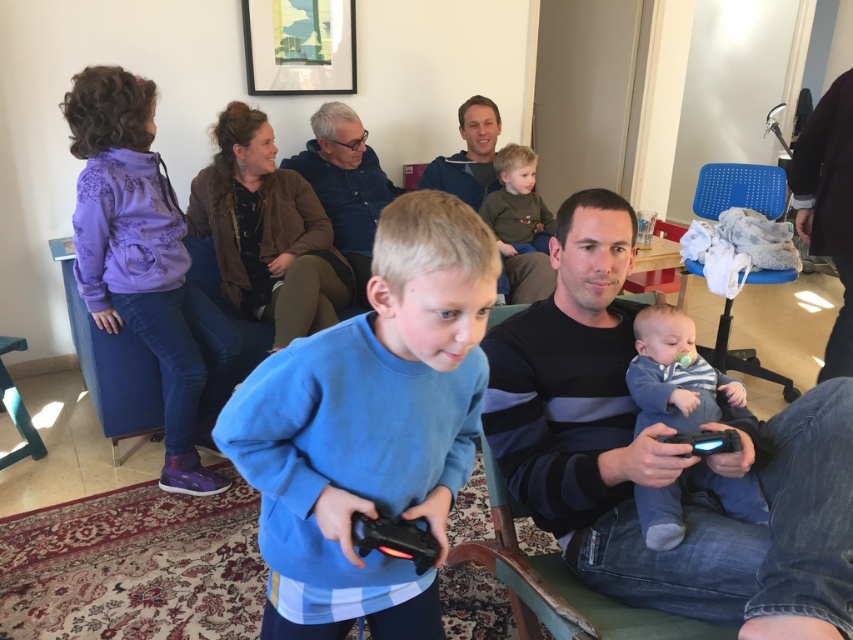
Question: Is blue mesh chair at upper right further to the viewer compared to dark green sweater at center?

Choices:
 (A) no
 (B) yes

Answer: (A)

Question: Does dark gray striped shirt at center appear on the right side of blue mesh chair at upper right?

Choices:
 (A) yes
 (B) no

Answer: (B)

Question: Which point appears closest to the camera in this image?

Choices:
 (A) (592, 621)
 (B) (724, 176)
 (C) (846, 593)

Answer: (C)

Question: Considering the real-world distances, which object is farthest from the blue fleece sweatshirt at center?

Choices:
 (A) matte blue shirt at center
 (B) striped knit sweater at center
 (C) blue mesh chair at upper right

Answer: (A)

Question: Is dark blue fabric armchair at center thinner than dark green sweater at center?

Choices:
 (A) yes
 (B) no

Answer: (B)

Question: Which point is closer to the camera?

Choices:
 (A) dark gray striped shirt at center
 (B) dark green sweater at center
 (C) blue fleece sweatshirt at center

Answer: (C)